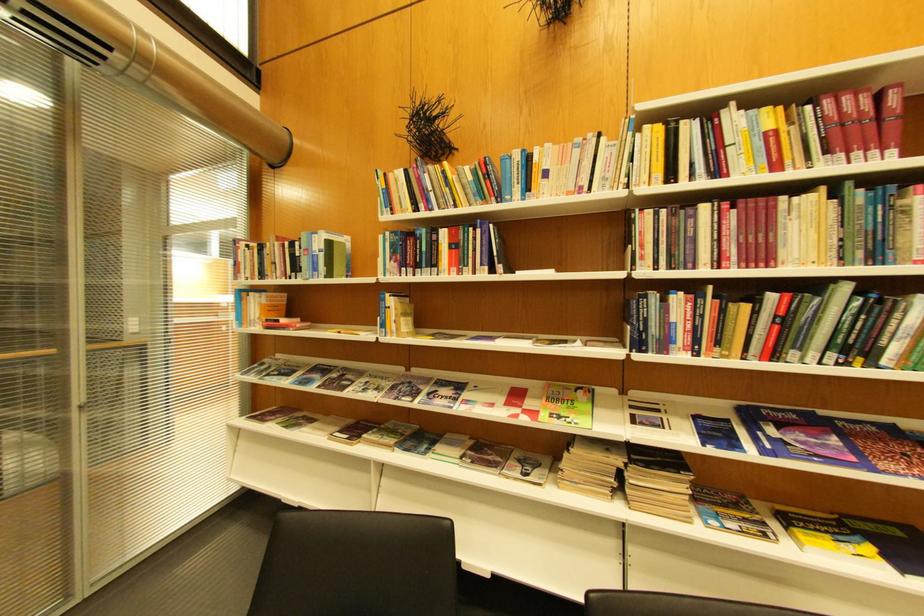
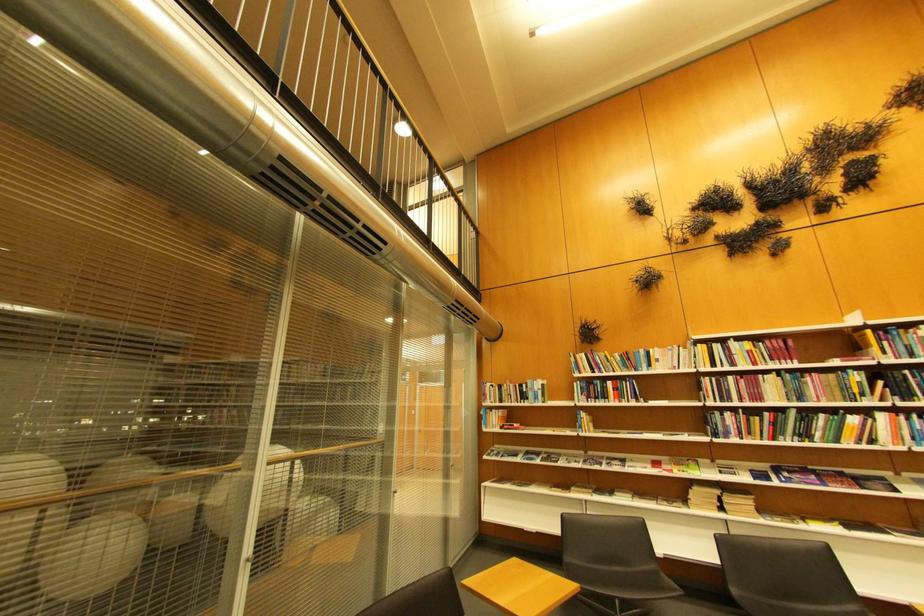
Locate, in the second image, the point that corresponds to the point at 856,291 in the first image.

(804, 413)